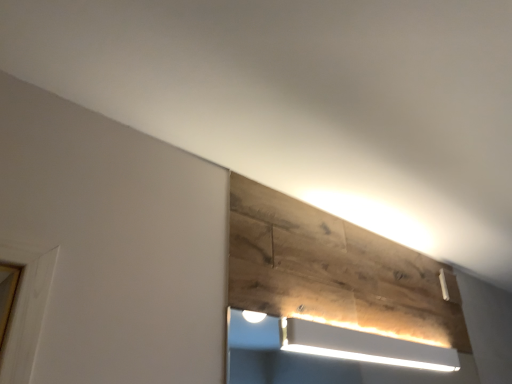
I want to click on white frosted glass at upper center, so click(364, 346).

What do you see at coordinates (364, 346) in the screenshot? This screenshot has width=512, height=384. I see `white frosted glass at upper center` at bounding box center [364, 346].

Identify the location of white frosted glass at upper center. The width and height of the screenshot is (512, 384). (364, 346).